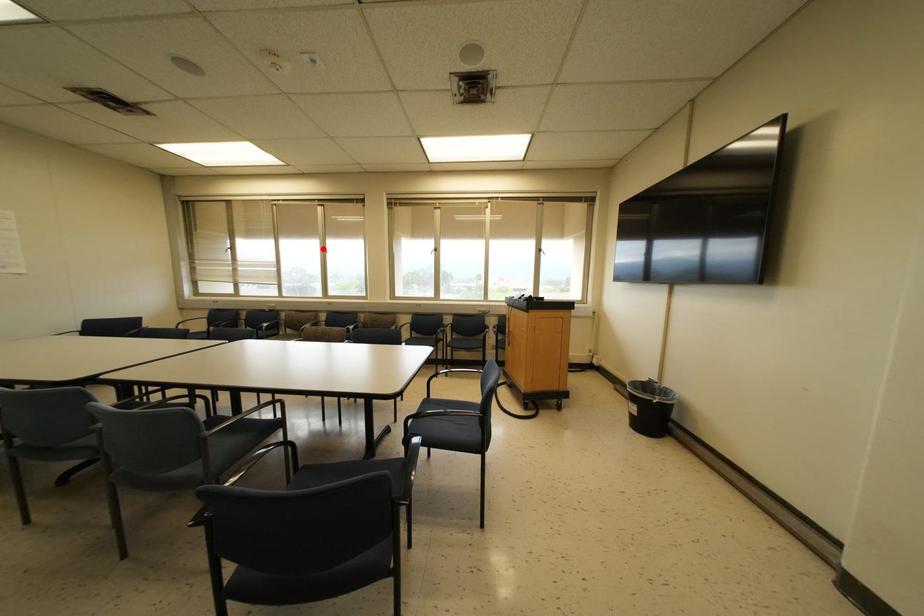
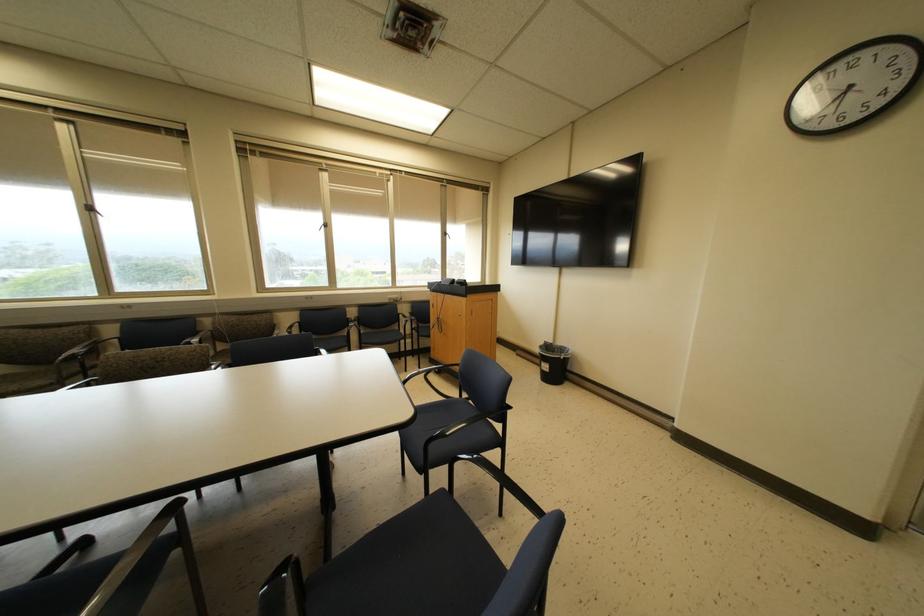
Question: I am providing you with two images of the same scene from different viewpoints. Image1 has a red point marked. In image2, the corresponding 3D location appears at what relative position? Reply with the corresponding letter.

Choices:
 (A) Closer
 (B) Farther

Answer: (B)